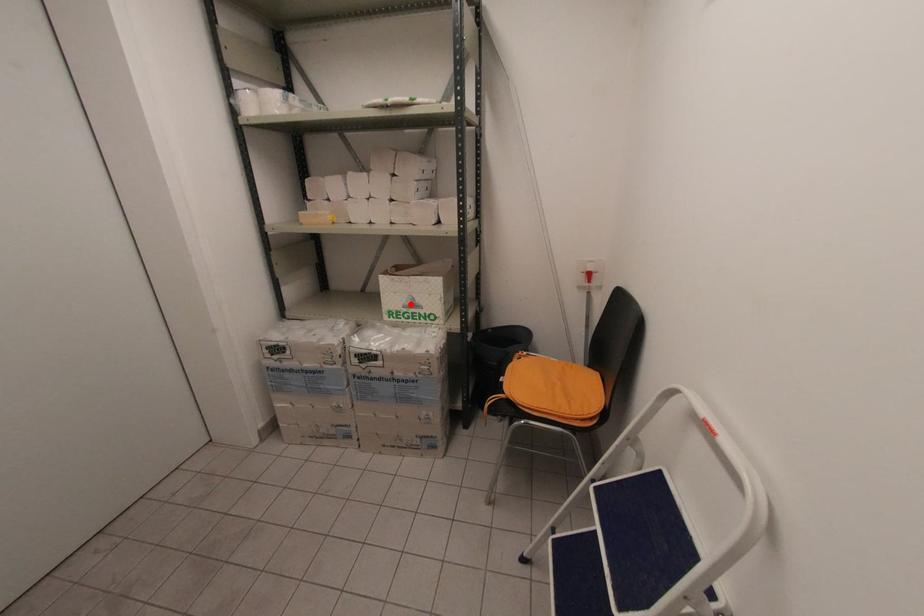
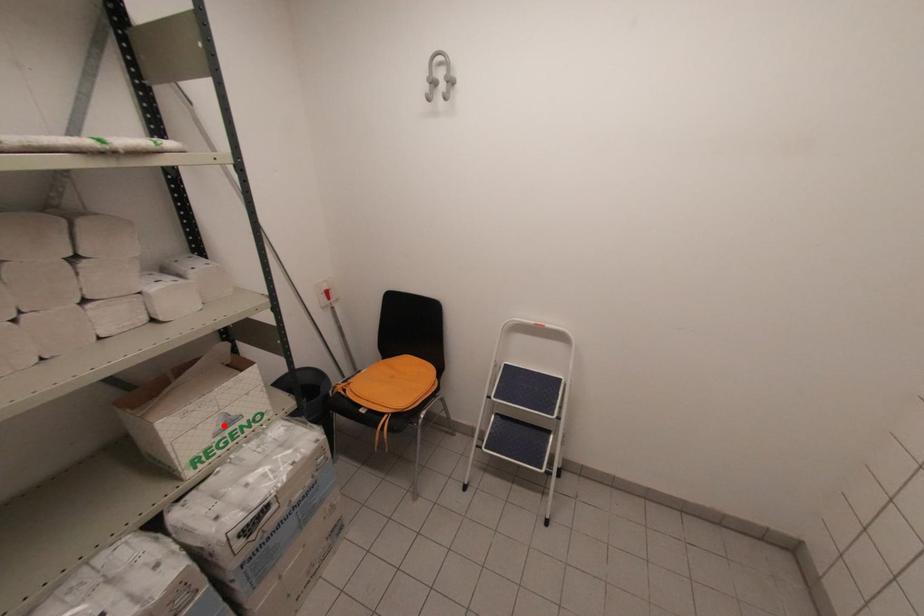
I am providing you with two images of the same scene from different viewpoints. A red point is marked on the first image and another point is marked on the second image. Does the point marked in image1 correspond to the same location as the one in image2?

Yes